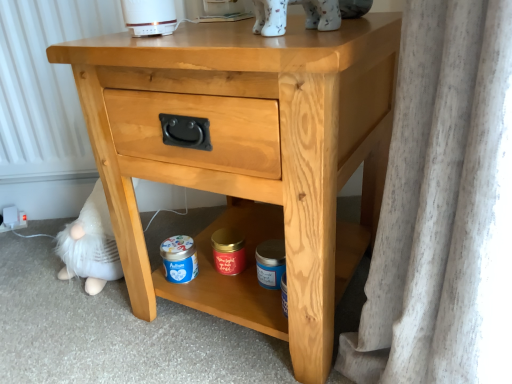
Question: Is white porcelain cat at upper center at the left side of red matte candle at center, the 1th pottery from the left?

Choices:
 (A) no
 (B) yes

Answer: (A)

Question: Is white porcelain cat at upper center in front of red matte candle at center, the 1th pottery from the left?

Choices:
 (A) no
 (B) yes

Answer: (B)

Question: Is white porcelain cat at upper center at the right side of red matte candle at center, the 1th pottery from the left?

Choices:
 (A) yes
 (B) no

Answer: (A)

Question: Is white porcelain cat at upper center wider than red matte candle at center, placed as the second pottery when sorted from right to left?

Choices:
 (A) yes
 (B) no

Answer: (A)

Question: From a real-world perspective, is white porcelain cat at upper center physically below red matte candle at center, the 1th pottery from the left?

Choices:
 (A) yes
 (B) no

Answer: (B)

Question: Which is correct: blue matte jar at lower center, acting as the 2th pottery starting from the left, is inside blue matte jar at lower center, or outside of it?

Choices:
 (A) outside
 (B) inside

Answer: (A)

Question: From the image's perspective, is blue matte jar at lower center, acting as the 2th pottery starting from the left, above or below blue matte jar at lower center?

Choices:
 (A) below
 (B) above

Answer: (A)

Question: Considering the positions of blue matte jar at lower center, the first pottery from the right, and blue matte jar at lower center in the image, is blue matte jar at lower center, the first pottery from the right, wider or thinner than blue matte jar at lower center?

Choices:
 (A) wide
 (B) thin

Answer: (A)

Question: From a real-world perspective, is blue matte jar at lower center, acting as the 2th pottery starting from the left, physically located above or below blue matte jar at lower center?

Choices:
 (A) below
 (B) above

Answer: (A)

Question: From a real-world perspective, is blue matte jar at lower center, acting as the 2th pottery starting from the left, physically located above or below red matte candle at center, placed as the second pottery when sorted from right to left?

Choices:
 (A) below
 (B) above

Answer: (B)

Question: In terms of width, does blue matte jar at lower center, acting as the 2th pottery starting from the left, look wider or thinner when compared to red matte candle at center, the 1th pottery from the left?

Choices:
 (A) wide
 (B) thin

Answer: (A)

Question: Is point (262, 269) positioned closer to the camera than point (214, 233)?

Choices:
 (A) farther
 (B) closer

Answer: (B)

Question: From their relative heights in the image, would you say blue matte jar at lower center, acting as the 2th pottery starting from the left, is taller or shorter than red matte candle at center, placed as the second pottery when sorted from right to left?

Choices:
 (A) short
 (B) tall

Answer: (B)

Question: Is white porcelain cat at upper center taller or shorter than blue matte jar at lower center, the first pottery from the right?

Choices:
 (A) tall
 (B) short

Answer: (A)

Question: Visually, is white porcelain cat at upper center positioned to the left or to the right of blue matte jar at lower center, acting as the 2th pottery starting from the left?

Choices:
 (A) right
 (B) left

Answer: (B)